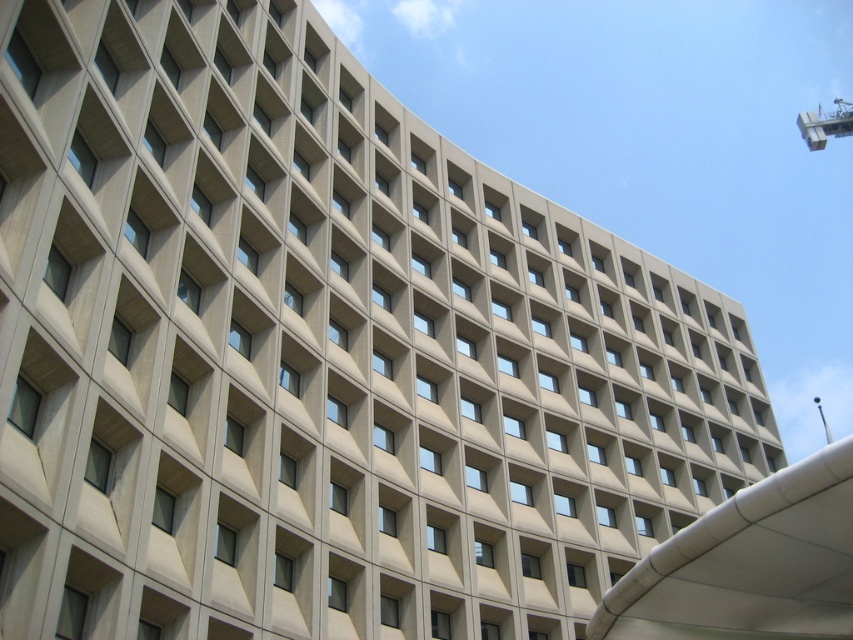
Between white matte lift at lower right and metallic crane at upper right, which one appears on the left side from the viewer's perspective?

white matte lift at lower right is more to the left.

Can you confirm if white matte lift at lower right is shorter than metallic crane at upper right?

Yes.

Where is `white matte lift at lower right`? This screenshot has height=640, width=853. white matte lift at lower right is located at coordinates (749, 564).